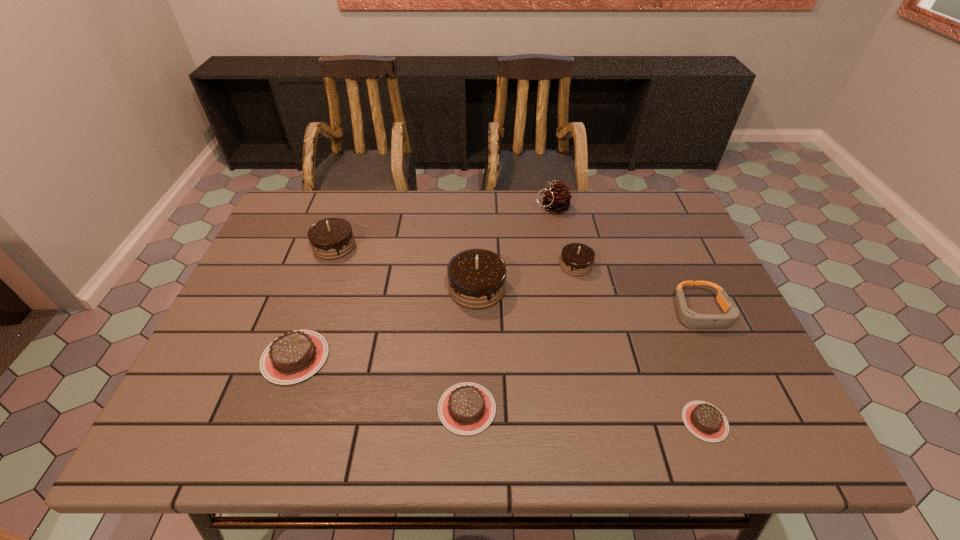
Where is `the third closest brown chocolate cake to the farthest object`? the third closest brown chocolate cake to the farthest object is located at coordinates (293, 357).

Find the location of a particular element. This screenshot has height=540, width=960. brown chocolate cake that is the nearest to the leftmost brown chocolate cake is located at coordinates [467, 408].

Image resolution: width=960 pixels, height=540 pixels. What are the coordinates of `vacant area that satisfies the following two spatial constraints: 1. on the back side of the second brown chocolate cake from right to left; 2. on the right side of the rightmost chocolate chocolate cake` in the screenshot? It's located at pyautogui.click(x=470, y=265).

At what (x,y) coordinates should I click in order to perform the action: click on vacant space that satisfies the following two spatial constraints: 1. with a leaf charm attached to the farthest object; 2. on the left side of the rightmost chocolate cake. Please return your answer as a coordinate pair (x, y). Image resolution: width=960 pixels, height=540 pixels. Looking at the image, I should click on (593, 421).